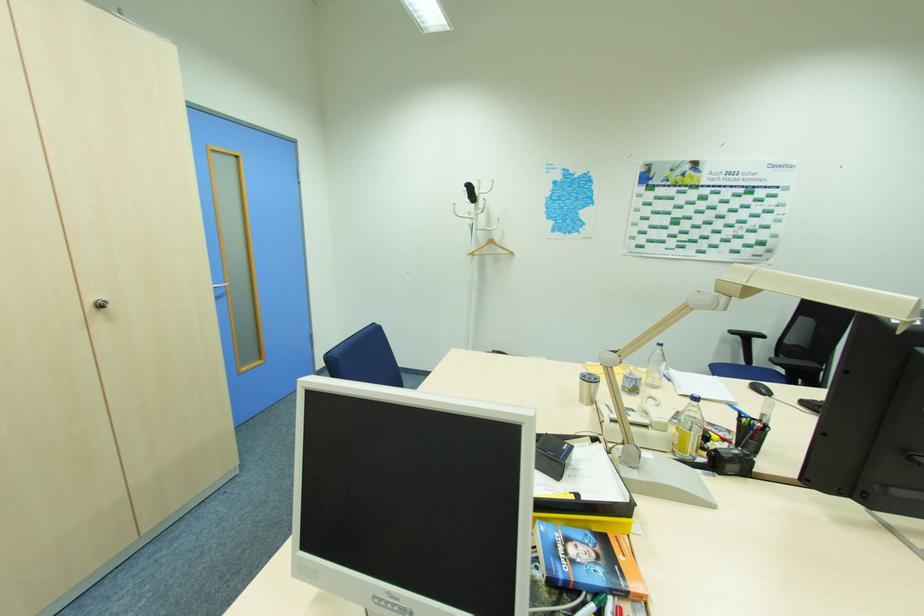
Find where to lift the telephone handset. Please return your answer as a coordinate pair (x, y).

(469, 192)